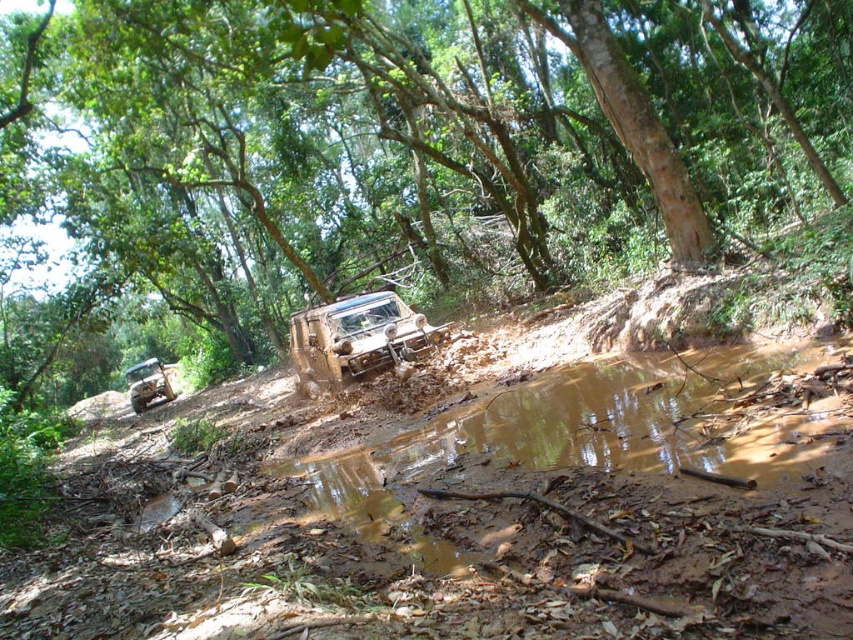
Can you confirm if brown rough tree at upper center is wider than brown matte jeep at center?

Correct, the width of brown rough tree at upper center exceeds that of brown matte jeep at center.

Is brown rough tree at upper center taller than brown matte jeep at center?

Yes, brown rough tree at upper center is taller than brown matte jeep at center.

Which is behind, point (671, 136) or point (294, 337)?

The point (671, 136) is more distant.

The image size is (853, 640). In order to click on brown rough tree at upper center in this screenshot , I will do `click(409, 141)`.

Which is more to the right, brown rough tree at upper center or brushed metal jeep at lower left?

brown rough tree at upper center is more to the right.

Locate an element on the screen. brown rough tree at upper center is located at coordinates (409, 141).

Where is `brown rough tree at upper center`? This screenshot has width=853, height=640. brown rough tree at upper center is located at coordinates (409, 141).

Find the location of `brown rough tree at upper center`. brown rough tree at upper center is located at coordinates (409, 141).

Consider the image. Does brown rough tree at upper center lie in front of brown muddy dirt track at center?

No.

Is point (503, 61) more distant than point (368, 556)?

Yes, point (503, 61) is behind point (368, 556).

I want to click on brown rough tree at upper center, so click(409, 141).